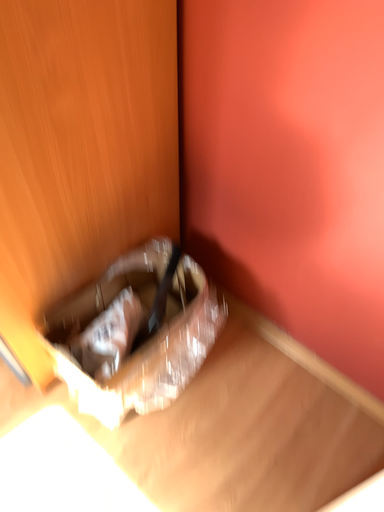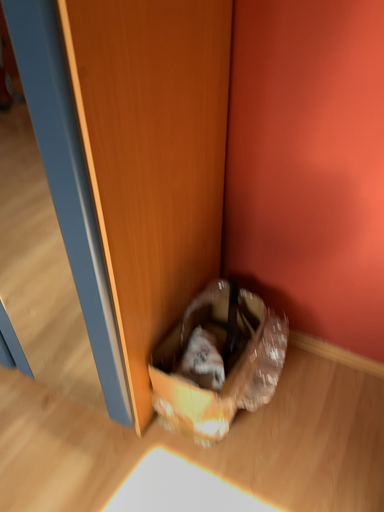
Question: Which way did the camera rotate in the video?

Choices:
 (A) rotated upward
 (B) rotated downward

Answer: (A)